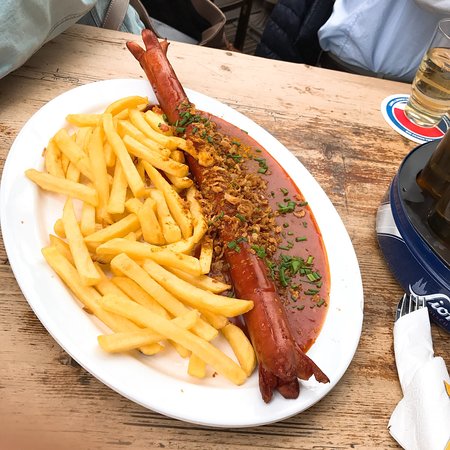
I want to click on glass, so click(x=430, y=96).